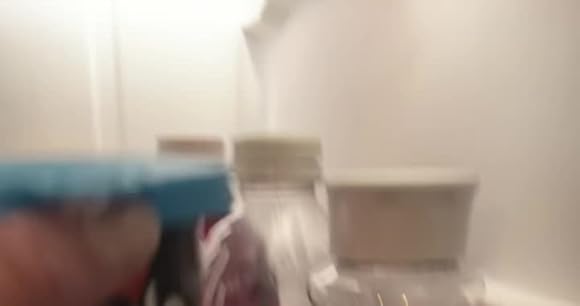
This screenshot has width=580, height=306. Identify the location of bottles. (293, 230), (208, 223).